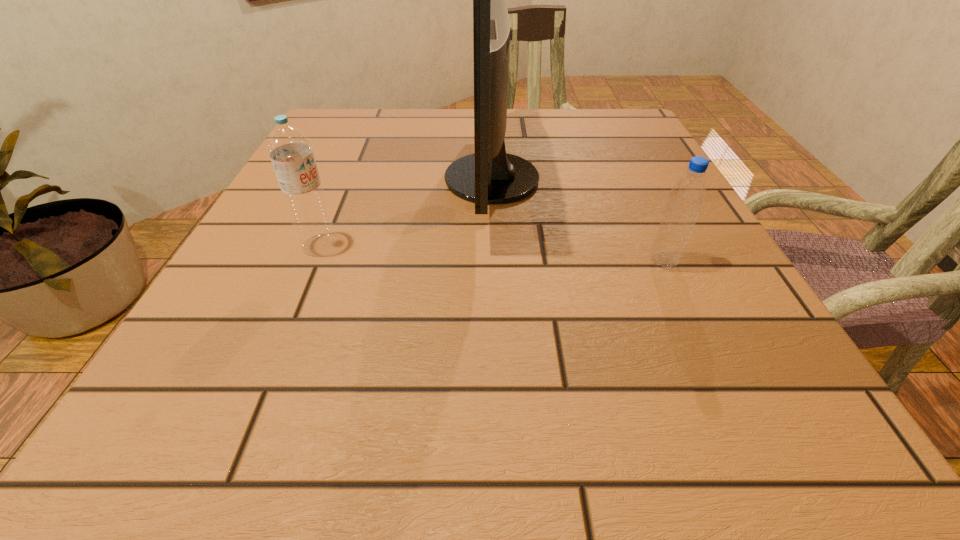
Find the location of a particular element. vacant point located between the rightmost object and the left water bottle is located at coordinates (492, 253).

The width and height of the screenshot is (960, 540). What are the coordinates of `free space between the shortest object and the second tallest object` in the screenshot? It's located at (492, 253).

This screenshot has height=540, width=960. Find the location of `vacant space in between the second object from right to left and the rightmost object`. vacant space in between the second object from right to left and the rightmost object is located at coordinates (578, 220).

Identify the location of unoccupied area between the shorter water bottle and the second object from left to right. (578, 220).

You are a GUI agent. You are given a task and a screenshot of the screen. Output one action in this format:
    pyautogui.click(x=<x>, y=<y>)
    Task: Click on the empty space that is in between the leftmost object and the tallest object
    This screenshot has height=540, width=960.
    Given the screenshot: What is the action you would take?
    pyautogui.click(x=405, y=212)

Identify the location of unoccupied area between the taller water bottle and the second object from right to left. (405, 212).

Find the location of a particular element. The width and height of the screenshot is (960, 540). vacant area between the monitor and the rightmost object is located at coordinates (578, 220).

Locate an element on the screen. unoccupied area between the taller water bottle and the tallest object is located at coordinates (405, 212).

You are a GUI agent. You are given a task and a screenshot of the screen. Output one action in this format:
    pyautogui.click(x=<x>, y=<y>)
    Task: Click on the free area in between the tallest object and the second tallest object
    The height and width of the screenshot is (540, 960).
    Given the screenshot: What is the action you would take?
    (405, 212)

Choose which object is the nearest neighbor to the shortest object. Please provide its 2D coordinates. Your answer should be formatted as a tuple, i.e. [(x, y)], where the tuple contains the x and y coordinates of a point satisfying the conditions above.

[(489, 176)]